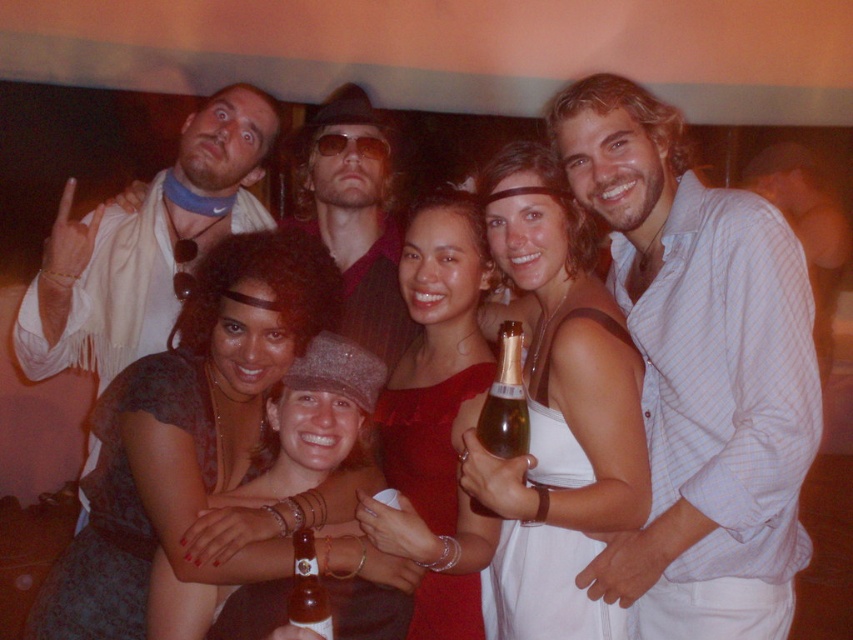
You are a photographer at this event and want to ensure both the light blue striped shirt at center and the matte black dress at center are clearly visible in your photo. Given their sizes, which one might you need to adjust your camera focus for to ensure clarity?

The light blue striped shirt at center is larger in size than the matte black dress at center, so you might need to adjust your camera focus for the larger light blue striped shirt at center to ensure its details are clear.

You are standing at the camera position and want to take a photo of the group. The closest person to the camera is 1.5 meters away. Is the point at coordinate point (148, 570) within the focus range of your camera if the focus range is set to 1.5 to 2.5 meters?

The point at coordinate point (148, 570) is 1.93 meters from the camera, which falls within the focus range of 1.5 to 2.5 meters. Therefore, the point will be in focus.